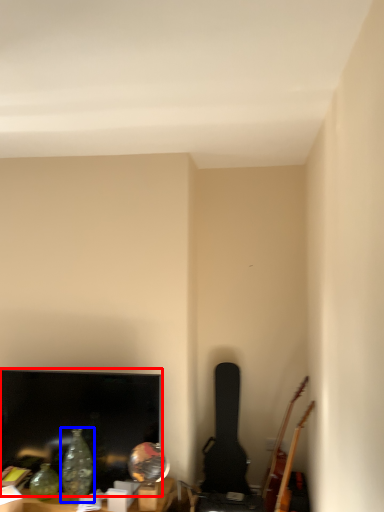
Question: Which object appears farthest to the camera in this image, television (highlighted by a red box) or glass vase (highlighted by a blue box)?

Choices:
 (A) television
 (B) glass vase

Answer: (A)